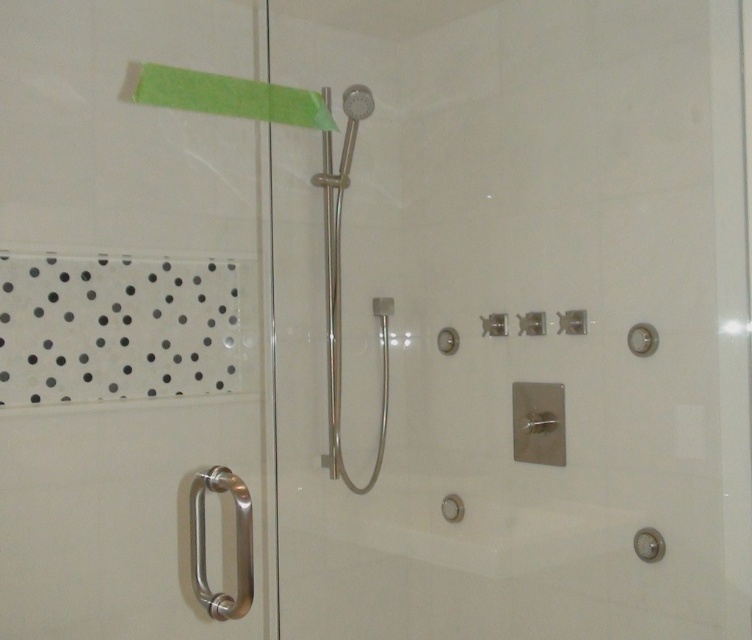
Looking at this image, you are designing a bathroom layout and need to choose between the polished chrome shower head at center and the satin nickel showerhead at upper center. Which one is bigger in size?

The polished chrome shower head at center has a larger size compared to the satin nickel showerhead at upper center.

Looking at this image, you are a plumber inspecting a shower. You see the polished chrome shower head at center and the satin nickel showerhead at upper center. Which one is taller?

The polished chrome shower head at center is taller than the satin nickel showerhead at upper center.